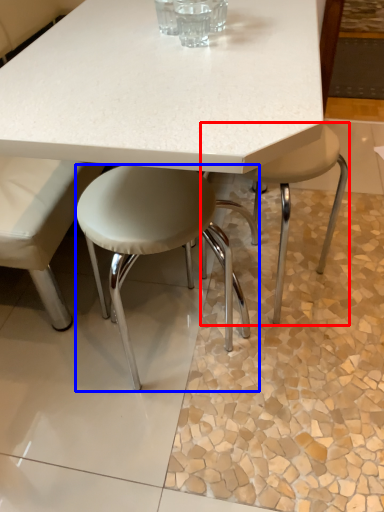
Question: Which point is closer to the camera, stool (highlighted by a red box) or stool (highlighted by a blue box)?

Choices:
 (A) stool
 (B) stool

Answer: (B)